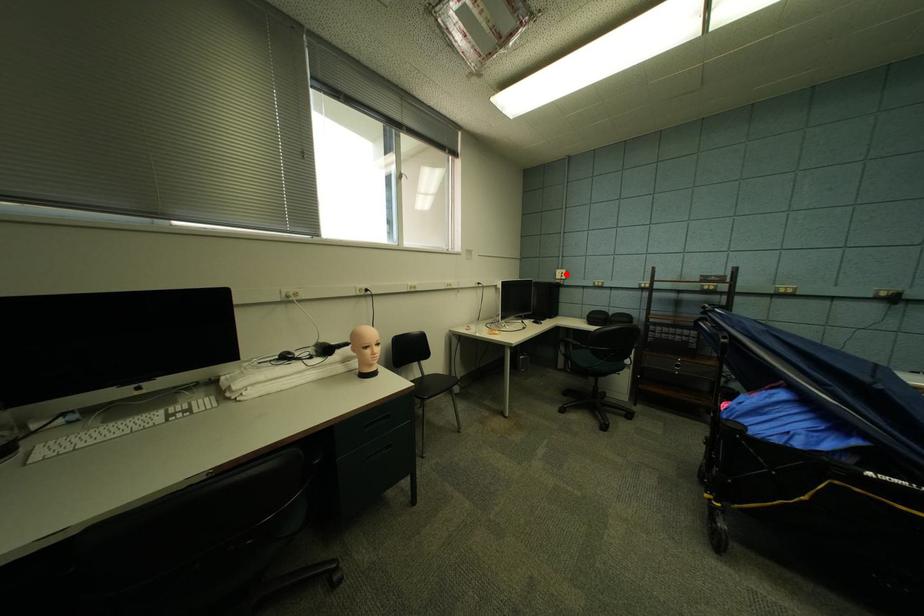
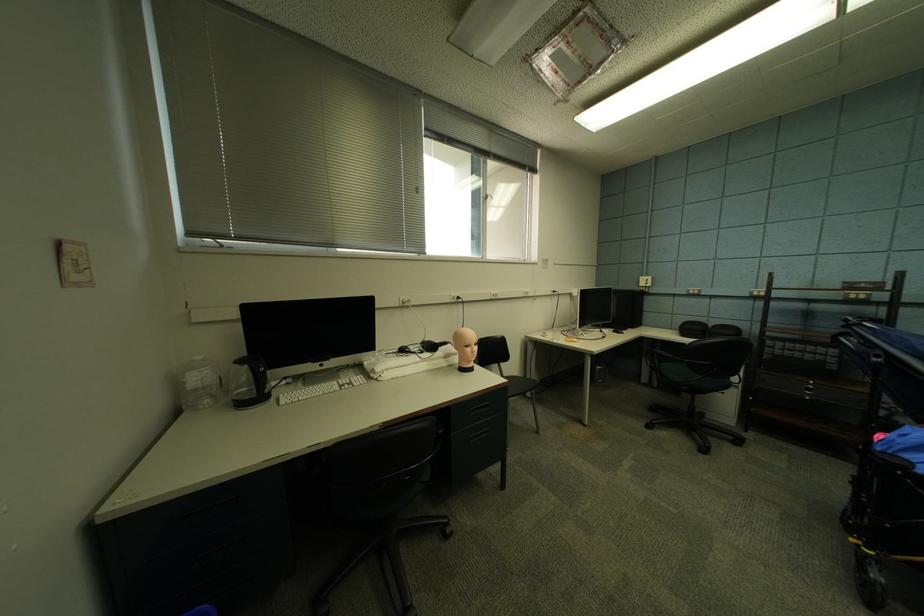
Where in the second image is the point corresponding to the highlighted location from the first image?

(650, 282)